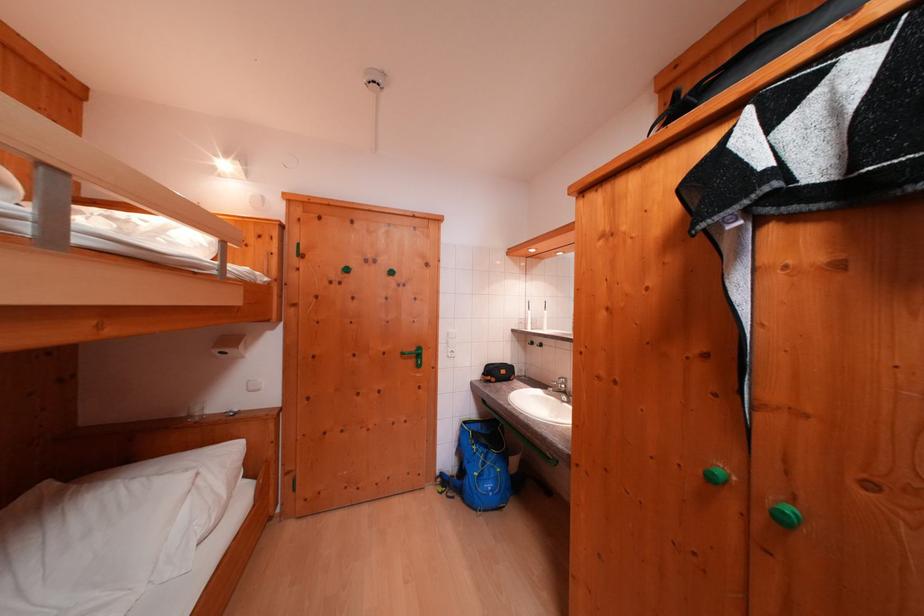
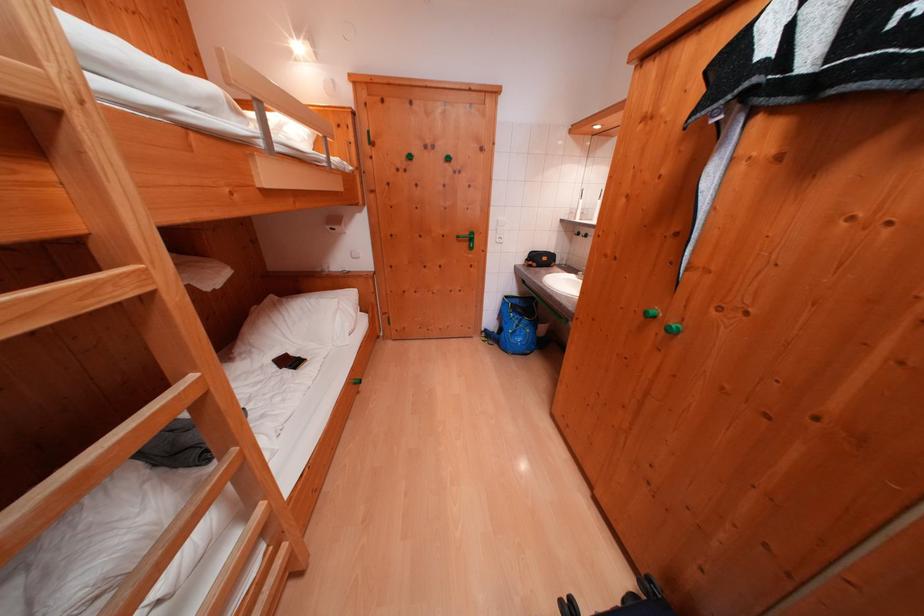
Locate, in the second image, the point that corresponds to pixel 473 427 in the first image.

(515, 301)